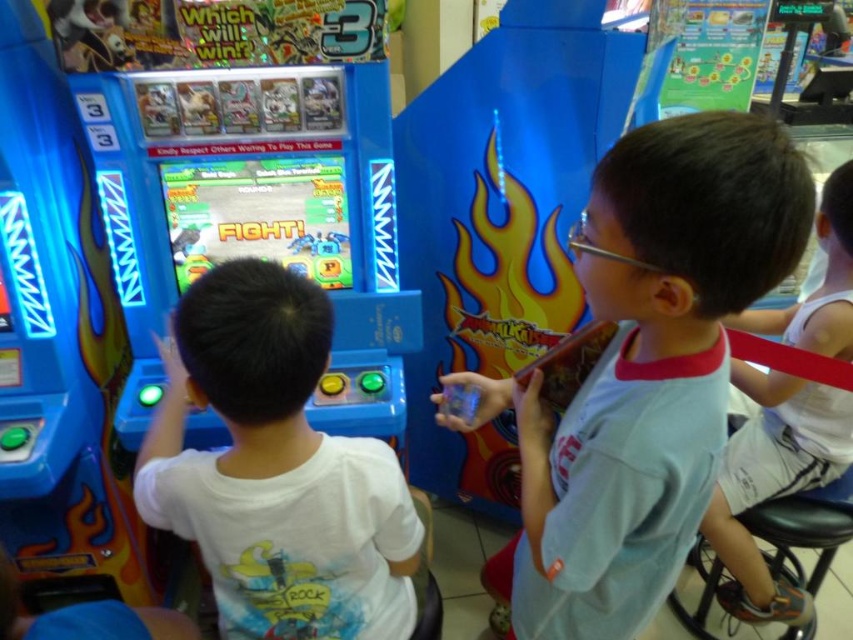
You are a customer at the arcade and want to play the game on the shiny plastic screen at center. To start the game, you need to press a button located on the light blue fabric shirt at center. Is the button easy to reach from your standing position?

The light blue fabric shirt at center is located below the shiny plastic screen at center, so the button on the light blue fabric shirt at center is positioned lower than the screen. Depending on your height and reach, it might be accessible, but the exact ease of reaching it isn

You are standing in front of the bright blue arcade machine and see two points marked on its surface. Which point is closer to you, point at position (397, 605) or point at position (764, 440)?

Point at position (397, 605) is closer to the viewer than point at position (764, 440).

You are a customer in an arcade and see two shirts displayed on a mannequin at the center of the machine. The shirts are the light blue fabric shirt at center and the white matte shirt at center. Which shirt is taller?

The light blue fabric shirt at center has a greater height compared to the white matte shirt at center.